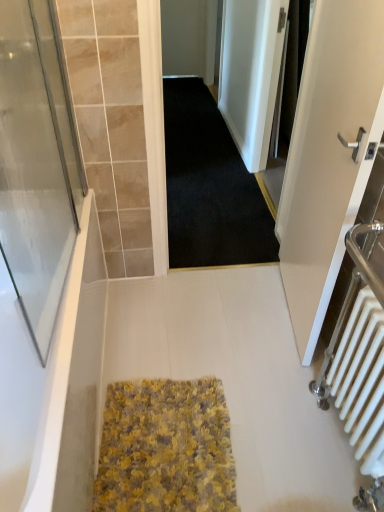
Where is `free area in between white matte door at right and yellow textured rug at center`? The height and width of the screenshot is (512, 384). free area in between white matte door at right and yellow textured rug at center is located at coordinates (241, 359).